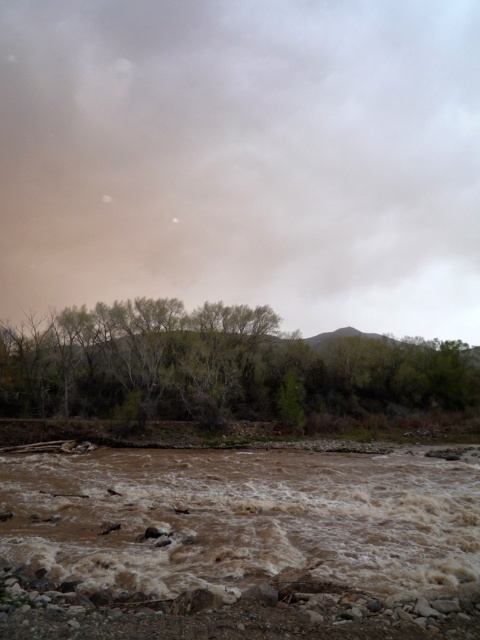
Between brown muddy water at lower center and green leafy trees at center, which one has more height?

green leafy trees at center

Which is more to the right, brown muddy water at lower center or green leafy trees at center?

green leafy trees at center

Find the location of `brown muddy water at lower center`. brown muddy water at lower center is located at coordinates (242, 516).

The height and width of the screenshot is (640, 480). In order to click on brown muddy water at lower center in this screenshot , I will do `click(242, 516)`.